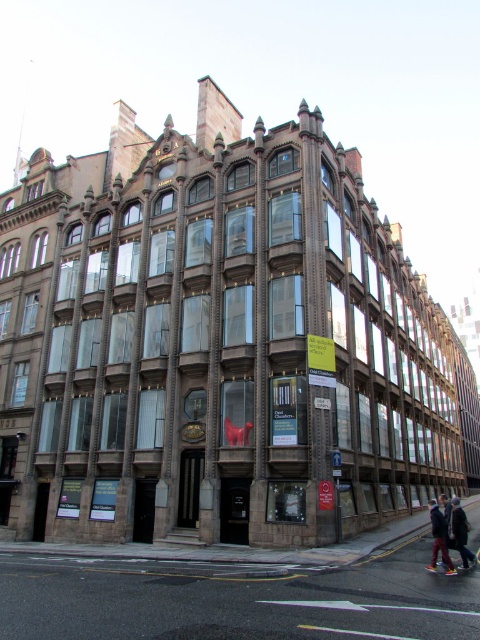
You are a delivery person who needs to place a large package on the ground near the building. The package must be placed where there is enough space and not obstruct the red sculpture of a horse. Considering the leather jacket at lower right and the matte red cross at center, which object should you place the package next to?

The leather jacket at lower right has a larger size compared to the matte red cross at center, so placing the package next to the leather jacket at lower right would provide more space and avoid obstructing the red sculpture of a horse.

Based on the photo, you are a person standing in front of the building and you see a leather jacket at lower right and dark blue jeans at lower right. Which one is higher?

The leather jacket at lower right is above dark blue jeans at lower right, so the leather jacket at lower right is higher.

You are standing at the entrance of the corner building and want to place a new decorative sculpture exactly at the center of the ground floor. However, there is already a red sculpture of a horse there. To avoid blocking the entrance, you need to move the existing red sculpture of a horse to the same position as the leather jacket at lower right. What are the coordinates you should input into the moving device to relocate the red sculpture?

The coordinates to move the red sculpture of a horse to the position of the leather jacket at lower right are (439, 540).